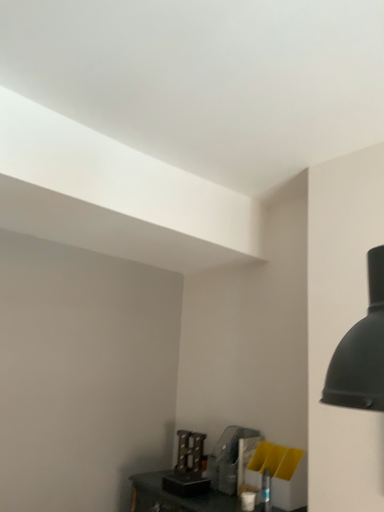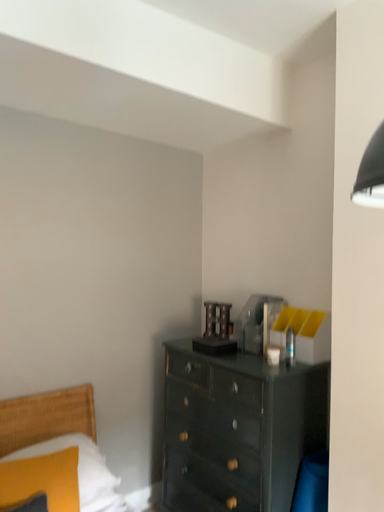
Question: How did the camera likely rotate when shooting the video?

Choices:
 (A) rotated upward
 (B) rotated downward

Answer: (B)